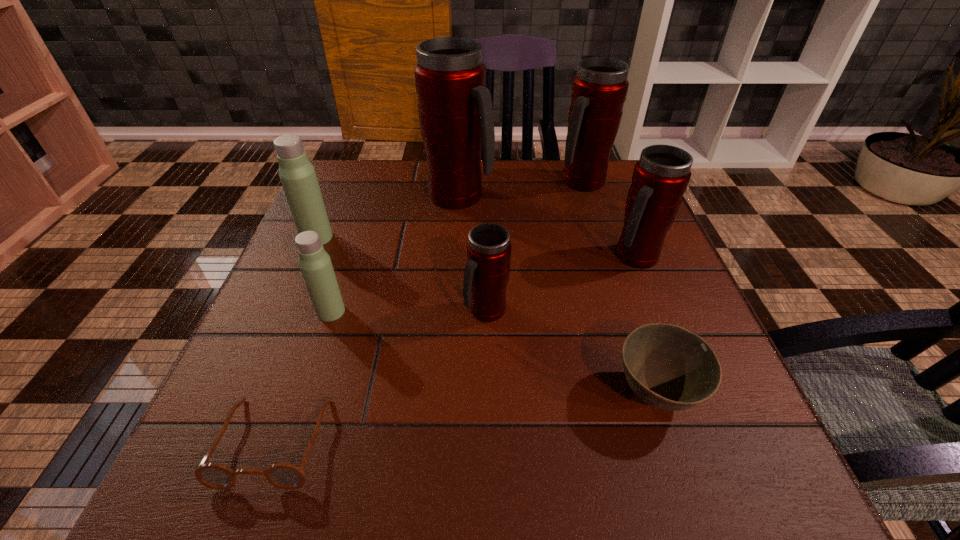
The width and height of the screenshot is (960, 540). I want to click on spectacles positioned at the left edge, so click(285, 476).

This screenshot has width=960, height=540. What are the coordinates of `bowl that is at the right edge` in the screenshot? It's located at (668, 367).

Find the location of a particular element. object that is at the near left corner is located at coordinates (285, 476).

Locate an element on the screen. object that is at the far right corner is located at coordinates (599, 90).

The height and width of the screenshot is (540, 960). What are the coordinates of `vacant region at the far edge of the desktop` in the screenshot? It's located at (503, 164).

In the image, there is a desktop. Where is `vacant space at the near edge`? The image size is (960, 540). vacant space at the near edge is located at coordinates (516, 498).

In the image, there is a desktop. Find the location of `vacant space at the left edge`. vacant space at the left edge is located at coordinates (275, 418).

You are a GUI agent. You are given a task and a screenshot of the screen. Output one action in this format:
    pyautogui.click(x=<x>, y=<y>)
    Task: Click on the vacant space at the right edge of the desktop
    This screenshot has height=540, width=960.
    Given the screenshot: What is the action you would take?
    pyautogui.click(x=669, y=280)

Where is `free region at the far left corner of the desktop`? The width and height of the screenshot is (960, 540). free region at the far left corner of the desktop is located at coordinates (332, 168).

Where is `free spot at the far right corner of the desktop`? free spot at the far right corner of the desktop is located at coordinates (626, 181).